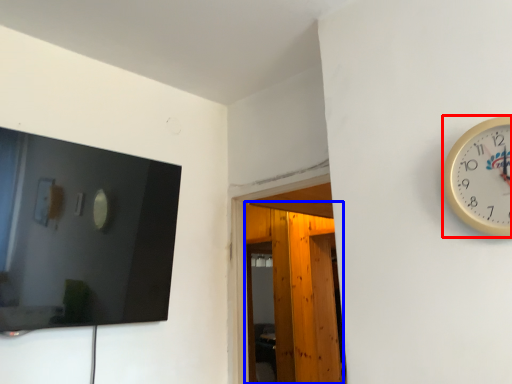
Question: Which object is closer to the camera taking this photo, wall clock (highlighted by a red box) or glass door (highlighted by a blue box)?

Choices:
 (A) wall clock
 (B) glass door

Answer: (A)